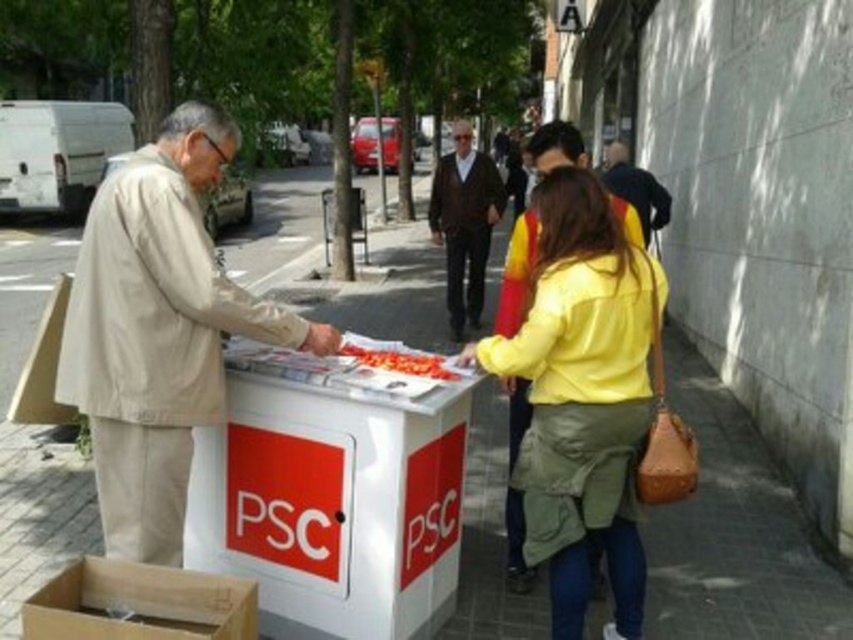
You are a pedestrian standing at the edge of the sidewalk where the PSC table is located. You want to hand a pamphlet to both the person in the yellow matte jacket at center and the person in the dark brown sweater at center. If you can only walk 5 meters forward, can you reach both individuals without moving further than that?

The yellow matte jacket at center is 5.40 meters away from dark brown sweater at center. Since the distance between them is greater than 5 meters, you cannot reach both individuals without exceeding the 5 meter limit.

You are standing at the point with coordinates point (245,634) and want to move to the point with coordinates point (502,428). Which direction should you move to get closer to your destination?

You should move forward because point (502,428) is closer to the viewer than point (245,634).